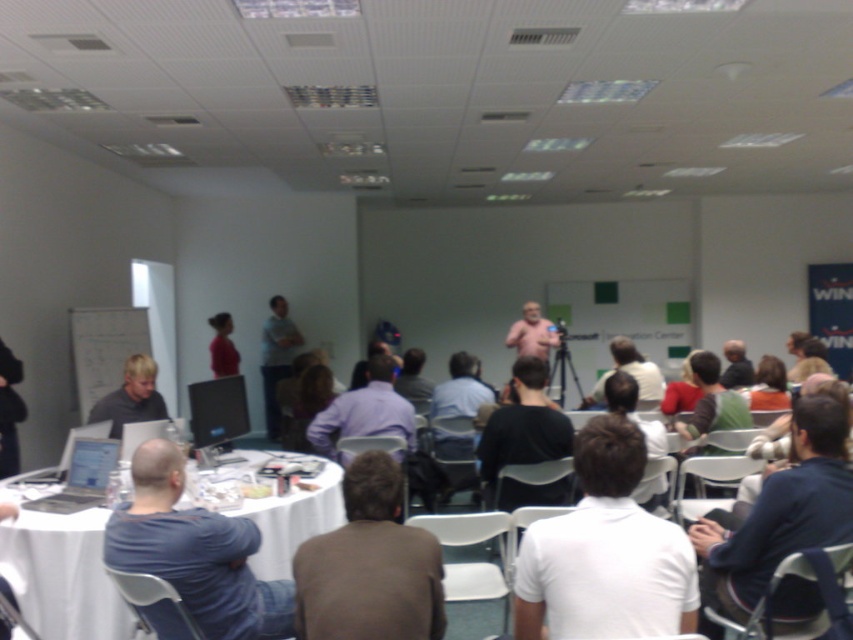
Question: Which is nearer to the black shirt at center?

Choices:
 (A) white fabric table at lower left
 (B) purple shirt at center

Answer: (B)

Question: Which object is positioned farthest from the light brown shirt at center?

Choices:
 (A) purple shirt at center
 (B) light gray shirt at center
 (C) black shirt at center

Answer: (B)

Question: Can you confirm if black shirt at center is smaller than purple shirt at center?

Choices:
 (A) no
 (B) yes

Answer: (B)

Question: Is white matte shirt at center closer to camera compared to light brown shirt at center?

Choices:
 (A) no
 (B) yes

Answer: (B)

Question: Which object is positioned farthest from the white matte shirt at center?

Choices:
 (A) white fabric table at lower left
 (B) light brown shirt at center
 (C) light gray shirt at center
 (D) dark red shirt at center

Answer: (C)

Question: Can you confirm if blonde hair man at left is wider than dark red shirt at center?

Choices:
 (A) no
 (B) yes

Answer: (B)